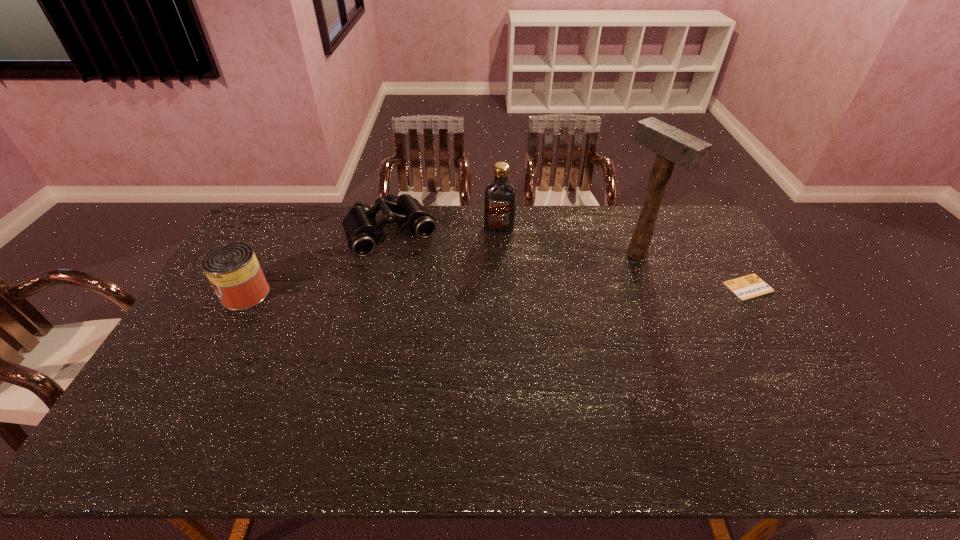
The width and height of the screenshot is (960, 540). Identify the location of can. (233, 270).

I want to click on the leftmost object, so click(233, 270).

What are the coordinates of `the shortest object` in the screenshot? It's located at (750, 286).

Identify the location of identity card. The height and width of the screenshot is (540, 960). (750, 286).

Identify the location of the tallest object. (673, 146).

Locate an element on the screen. the fourth object from left to right is located at coordinates point(673,146).

This screenshot has width=960, height=540. I want to click on the second tallest object, so click(x=499, y=195).

I want to click on the third object from right to left, so point(499,195).

Identify the location of the second shortest object. The height and width of the screenshot is (540, 960). (363, 232).

Where is `binoculars`? The width and height of the screenshot is (960, 540). binoculars is located at coordinates (363, 232).